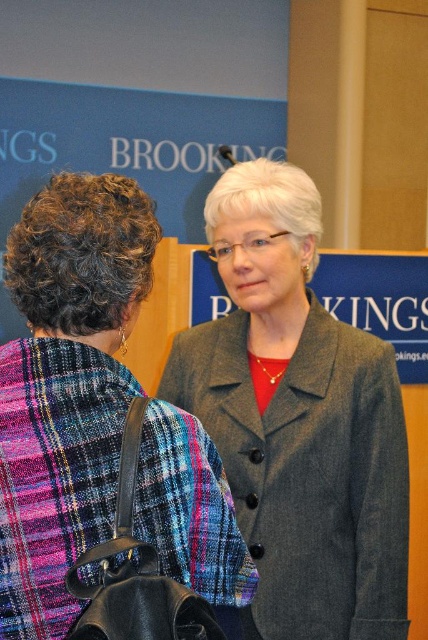
Does point (125, 403) lie behind point (184, 332)?

No, it is not.

Can you confirm if matte gray blazer at center is smaller than dark gray woolen coat at center?

Yes.

Which is behind, point (187, 497) or point (395, 634)?

Point (395, 634)

Locate an element on the screen. The height and width of the screenshot is (640, 428). matte gray blazer at center is located at coordinates (65, 387).